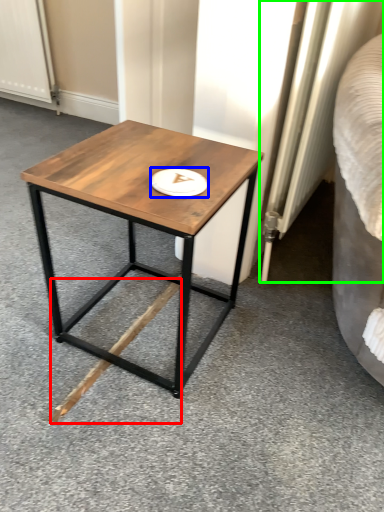
Question: Which object is positioned farthest from wood (highlighted by a red box)? Select from platter (highlighted by a blue box) and radiator (highlighted by a green box).

Choices:
 (A) platter
 (B) radiator

Answer: (B)